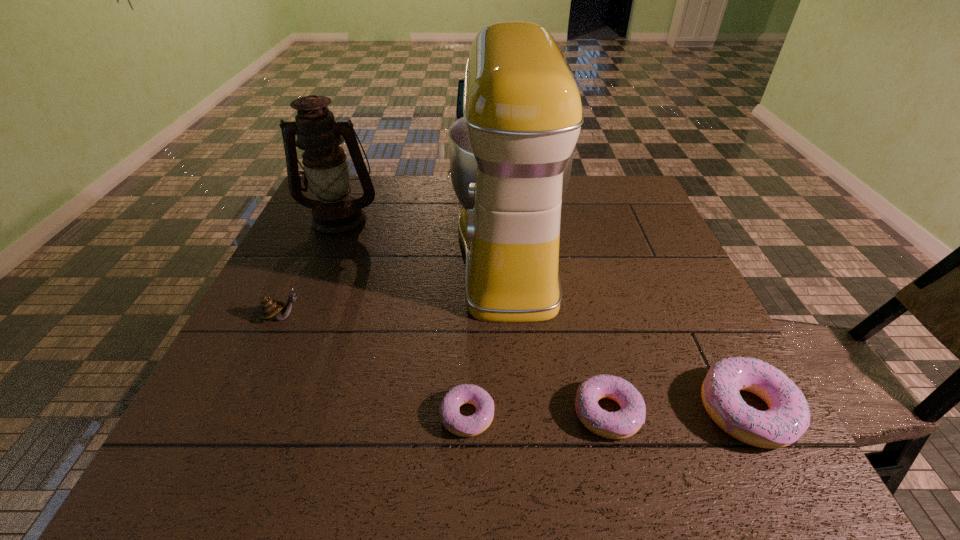
I want to click on doughnut that is the closest to the second tallest doughnut, so click(x=788, y=417).

At what (x,y) coordinates should I click in order to perform the action: click on doughnut that can be found as the third closest to the lantern. Please return your answer as a coordinate pair (x, y). Image resolution: width=960 pixels, height=540 pixels. Looking at the image, I should click on (788, 417).

This screenshot has width=960, height=540. I want to click on free space that satisfies the following two spatial constraints: 1. on the side of the second doughnut from right to left with the control knob; 2. on the right side of the tallest object, so click(x=521, y=413).

In order to click on free location that satisfies the following two spatial constraints: 1. on the face of the tallest doughnut; 2. on the right side of the snail in this screenshot , I will do tap(241, 410).

Where is `vacant space that satisfies the following two spatial constraints: 1. on the back side of the second doughnut from left to right; 2. on the side of the mixer with the control knob`? This screenshot has width=960, height=540. vacant space that satisfies the following two spatial constraints: 1. on the back side of the second doughnut from left to right; 2. on the side of the mixer with the control knob is located at coordinates (568, 253).

Where is `free space that satisfies the following two spatial constraints: 1. on the face of the fourth shortest object; 2. on the left side of the rightmost object`? Image resolution: width=960 pixels, height=540 pixels. free space that satisfies the following two spatial constraints: 1. on the face of the fourth shortest object; 2. on the left side of the rightmost object is located at coordinates point(241,410).

The image size is (960, 540). I want to click on vacant space that satisfies the following two spatial constraints: 1. on the side of the tallest object with the control knob; 2. on the left side of the second shortest object, so click(x=521, y=413).

In order to click on vacant region that satisfies the following two spatial constraints: 1. on the face of the leftmost doughnut; 2. on the right side of the snail in this screenshot , I will do `click(238, 415)`.

Find the location of `vacant area in the image that satisfies the following two spatial constraints: 1. on the side of the tallest object with the control knob; 2. on the left side of the rightmost doughnut`. vacant area in the image that satisfies the following two spatial constraints: 1. on the side of the tallest object with the control knob; 2. on the left side of the rightmost doughnut is located at coordinates (521, 410).

This screenshot has width=960, height=540. I want to click on vacant space that satisfies the following two spatial constraints: 1. on the front side of the fourth tallest object; 2. on the left side of the lantern, so click(259, 410).